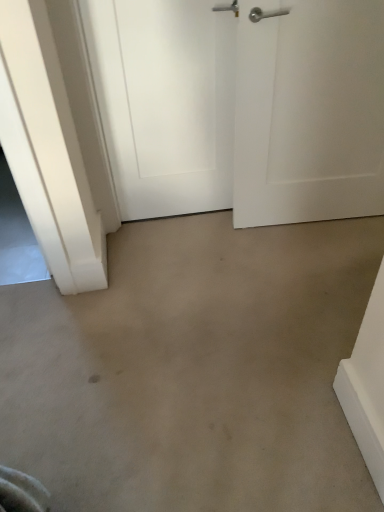
This screenshot has width=384, height=512. Find the location of `free location above beige carpet at center (from a real-world perspective)`. free location above beige carpet at center (from a real-world perspective) is located at coordinates (195, 341).